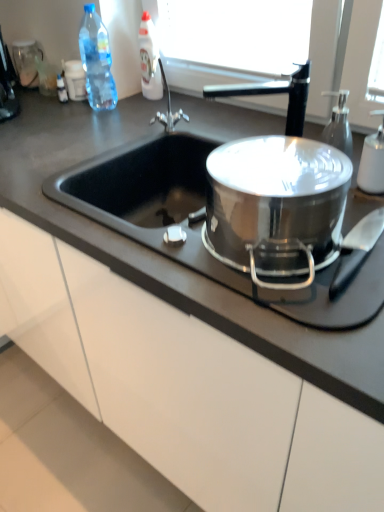
Find the location of a particular element. This screenshot has width=384, height=512. vacant space situated above black matte countertop at center (from a real-world perspective) is located at coordinates tap(196, 134).